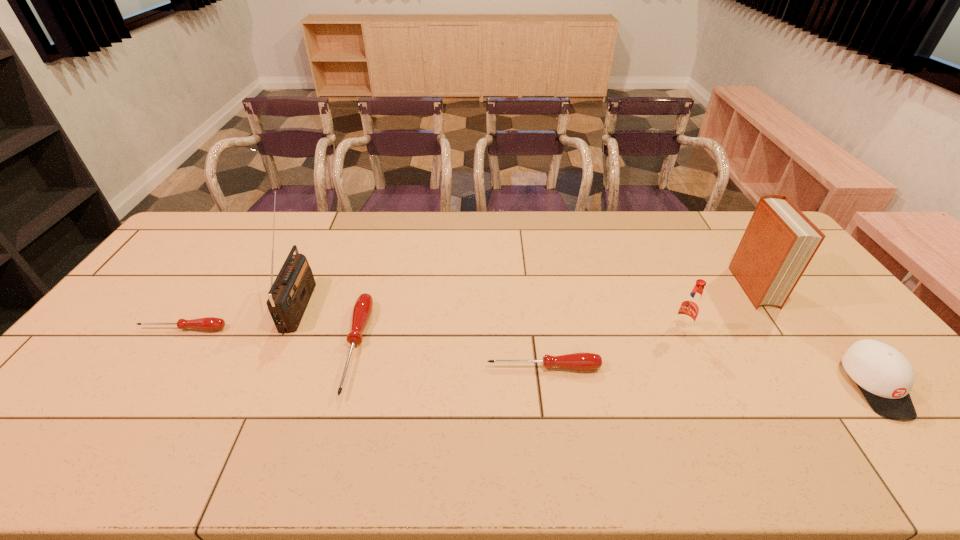
You are a GUI agent. You are given a task and a screenshot of the screen. Output one action in this format:
    pyautogui.click(x=<x>, y=<y>)
    Task: Click on the root beer
    Image resolution: width=960 pixels, height=540 pixels.
    Given the screenshot: What is the action you would take?
    pyautogui.click(x=689, y=310)

At what (x,y) coordinates should I click in order to perform the action: click on the fifth shortest object. Please return your answer as a coordinate pair (x, y). The height and width of the screenshot is (540, 960). Looking at the image, I should click on (689, 310).

Where is `vacant region located on the front of the shortest screwdriver`? vacant region located on the front of the shortest screwdriver is located at coordinates (141, 390).

In order to click on free point located on the right of the second screwdriver from right to left in this screenshot , I will do `click(417, 347)`.

The image size is (960, 540). Find the location of `free space located on the front of the fourth object from left to right`. free space located on the front of the fourth object from left to right is located at coordinates (550, 411).

At what (x,y) coordinates should I click in order to perform the action: click on vacant area situated 0.130m on the open cover of the hardback book. Please return your answer as a coordinate pair (x, y). This screenshot has height=540, width=960. Looking at the image, I should click on (792, 343).

At what (x,y) coordinates should I click in order to perform the action: click on free space located on the front-facing side of the sixth object from right to left. Please return your answer as a coordinate pair (x, y). This screenshot has width=960, height=540. Looking at the image, I should click on (381, 303).

Find the location of a particular element. The width and height of the screenshot is (960, 540). free space located 0.370m on the right of the fifth shortest object is located at coordinates (819, 329).

Locate an element on the screen. This screenshot has width=960, height=540. screwdriver that is at the near edge is located at coordinates pyautogui.click(x=362, y=309).

Where is `baseball cap positioned at the near edge`? baseball cap positioned at the near edge is located at coordinates pyautogui.click(x=885, y=377).